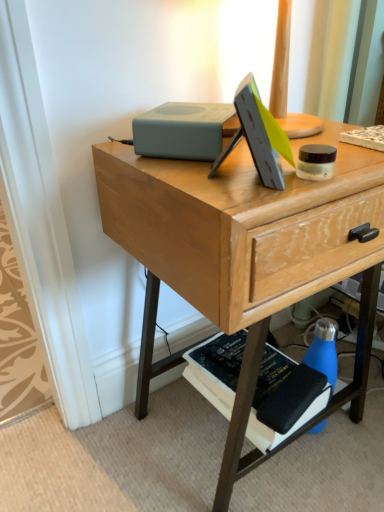
Question: From the image's perspective, relative to hardcover black book at lower right, is wooden desk at center above or below?

Choices:
 (A) below
 (B) above

Answer: (B)

Question: Is wooden desk at center inside the boundaries of hardcover black book at lower right, or outside?

Choices:
 (A) inside
 (B) outside

Answer: (B)

Question: Estimate the real-world distances between objects in this image. Which object is closer to the blue matte water bottle at lower right?

Choices:
 (A) hardcover black book at lower right
 (B) wooden desk at center

Answer: (A)

Question: Estimate the real-world distances between objects in this image. Which object is farther from the wooden desk at center?

Choices:
 (A) hardcover black book at lower right
 (B) blue matte water bottle at lower right

Answer: (B)